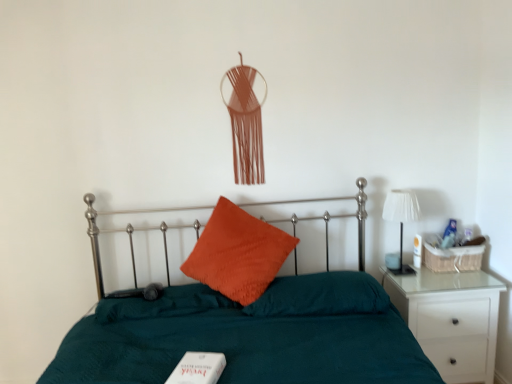
Question: From the image's perspective, would you say orange cotton pillow at center, the 2th pillow viewed from the right, is shown under white glossy nightstand at right?

Choices:
 (A) no
 (B) yes

Answer: (A)

Question: Considering the relative sizes of orange cotton pillow at center, the 2th pillow viewed from the right, and white glossy nightstand at right in the image provided, is orange cotton pillow at center, the 2th pillow viewed from the right, shorter than white glossy nightstand at right?

Choices:
 (A) yes
 (B) no

Answer: (A)

Question: Is orange cotton pillow at center, placed as the first pillow when sorted from left to right, bigger than white glossy nightstand at right?

Choices:
 (A) yes
 (B) no

Answer: (A)

Question: From a real-world perspective, is orange cotton pillow at center, the 2th pillow viewed from the right, physically below white glossy nightstand at right?

Choices:
 (A) no
 (B) yes

Answer: (A)

Question: Can you confirm if orange cotton pillow at center, placed as the first pillow when sorted from left to right, is thinner than white glossy nightstand at right?

Choices:
 (A) yes
 (B) no

Answer: (B)

Question: From a real-world perspective, is orange cotton pillow at center, placed as the first pillow when sorted from left to right, positioned over white glossy nightstand at right based on gravity?

Choices:
 (A) no
 (B) yes

Answer: (B)

Question: Is the depth of orange cotton pillow at center, the 2th pillow viewed from the right, less than that of orange velvet pillow at center, the 2th pillow from the left?

Choices:
 (A) yes
 (B) no

Answer: (A)

Question: Considering the relative positions of orange cotton pillow at center, the 2th pillow viewed from the right, and orange velvet pillow at center, the 2th pillow from the left, in the image provided, is orange cotton pillow at center, the 2th pillow viewed from the right, to the right of orange velvet pillow at center, the 2th pillow from the left, from the viewer's perspective?

Choices:
 (A) yes
 (B) no

Answer: (B)

Question: Is orange cotton pillow at center, the 2th pillow viewed from the right, facing away from orange velvet pillow at center, which is the first pillow from right to left?

Choices:
 (A) yes
 (B) no

Answer: (B)

Question: Can you confirm if orange cotton pillow at center, the 2th pillow viewed from the right, is thinner than orange velvet pillow at center, the 2th pillow from the left?

Choices:
 (A) yes
 (B) no

Answer: (A)

Question: Is orange velvet pillow at center, which is the first pillow from right to left, surrounded by orange cotton pillow at center, the 2th pillow viewed from the right?

Choices:
 (A) yes
 (B) no

Answer: (A)

Question: Does orange cotton pillow at center, placed as the first pillow when sorted from left to right, lie behind orange velvet pillow at center, the 2th pillow from the left?

Choices:
 (A) no
 (B) yes

Answer: (A)

Question: From the image's perspective, is teal fabric bed at center beneath white matte book at lower center?

Choices:
 (A) no
 (B) yes

Answer: (B)